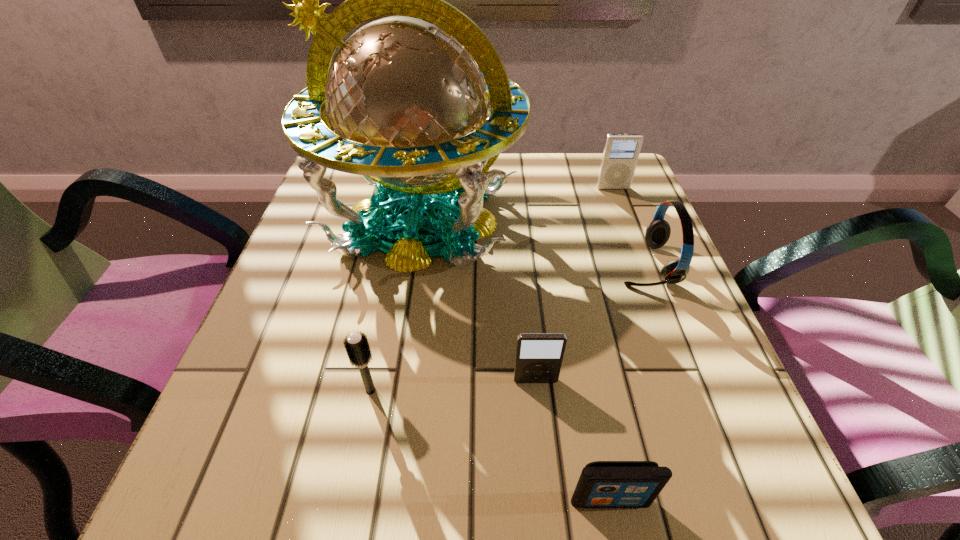
What are the coordinates of `headset present at the right edge` in the screenshot? It's located at (657, 234).

Locate an element on the screen. Image resolution: width=960 pixels, height=540 pixels. object that is at the far left corner is located at coordinates (405, 102).

Where is `object present at the far right corner`? Image resolution: width=960 pixels, height=540 pixels. object present at the far right corner is located at coordinates [x=621, y=152].

Find the location of `vacant space at the far edge of the desktop`. vacant space at the far edge of the desktop is located at coordinates (521, 165).

You are a GUI agent. You are given a task and a screenshot of the screen. Output one action in this format:
    pyautogui.click(x=<x>, y=<y>)
    Task: Click on the free space at the left edge
    
    Given the screenshot: What is the action you would take?
    pyautogui.click(x=329, y=279)

The height and width of the screenshot is (540, 960). I want to click on vacant space at the right edge of the desktop, so click(630, 319).

In the image, there is a desktop. Identify the location of vacant space at the near left corner. This screenshot has height=540, width=960. (273, 485).

The image size is (960, 540). I want to click on vacant area at the far right corner, so click(641, 205).

At what (x,y) coordinates should I click in order to perform the action: click on vacant space that's between the second farthest iPod and the farthest iPod. Please return your answer as a coordinate pair (x, y). This screenshot has width=960, height=540. Looking at the image, I should click on (574, 285).

The image size is (960, 540). In order to click on empty space that is in between the globe and the hairbrush in this screenshot , I will do `click(396, 305)`.